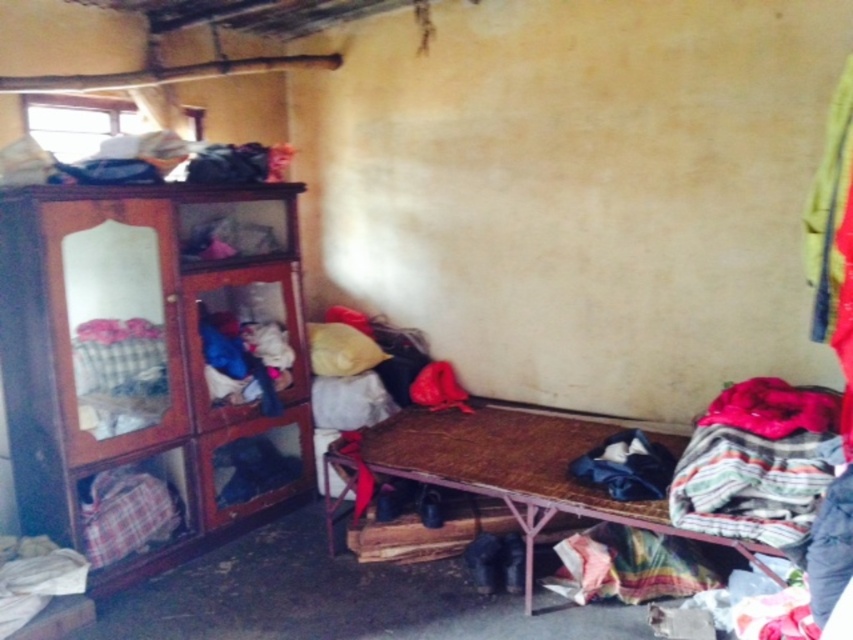
You are a GUI agent. You are given a task and a screenshot of the screen. Output one action in this format:
    pyautogui.click(x=<x>, y=<y>)
    Task: Click on the rustic wooden bed at lower right
    This screenshot has height=640, width=853.
    Given the screenshot: What is the action you would take?
    pyautogui.click(x=517, y=468)

Is rustic wooden bed at lower right bigger than plush fabric laundry at upper left?

Yes, rustic wooden bed at lower right is bigger than plush fabric laundry at upper left.

Between point (566, 512) and point (45, 172), which one is positioned in front?

Point (45, 172) is more forward.

This screenshot has height=640, width=853. I want to click on rustic wooden bed at lower right, so click(x=517, y=468).

Can you confirm if wooden wardrobe at left is positioned to the left of rustic wooden bed at lower right?

Yes, wooden wardrobe at left is to the left of rustic wooden bed at lower right.

Is point (114, 465) positioned behind point (447, 433)?

No.

Where is `wooden wardrobe at left`? wooden wardrobe at left is located at coordinates (144, 368).

Is wooden wardrobe at left positioned at the back of plush fabric laundry at upper left?

No, it is not.

Is point (128, 225) closer to viewer compared to point (270, 156)?

Yes, point (128, 225) is closer to viewer.

Between point (190, 433) and point (32, 156), which one is positioned behind?

Positioned behind is point (190, 433).

Locate an element on the screen. This screenshot has width=853, height=640. wooden wardrobe at left is located at coordinates (144, 368).